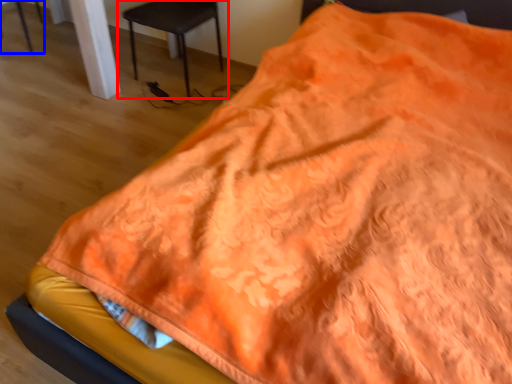
Question: Which object is further to the camera taking this photo, chair (highlighted by a red box) or chair (highlighted by a blue box)?

Choices:
 (A) chair
 (B) chair

Answer: (B)